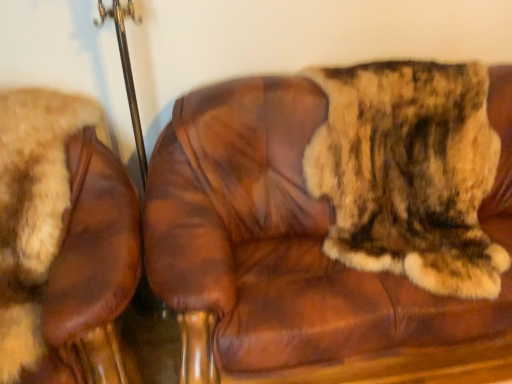
Locate an element on the screen. The width and height of the screenshot is (512, 384). brown leather chair at left, positioned as the second chair in right-to-left order is located at coordinates (32, 210).

Locate an element on the screen. The image size is (512, 384). fuzzy brown fur at right is located at coordinates (409, 172).

Which is behind, brown leather chair at center, which is the first chair in right-to-left order, or brown leather chair at left, the 1th chair in the left-to-right sequence?

brown leather chair at center, which is the first chair in right-to-left order, is more distant.

From the image's perspective, which is below, brown leather chair at center, the 2th chair in the left-to-right sequence, or brown leather chair at left, the 1th chair in the left-to-right sequence?

brown leather chair at left, the 1th chair in the left-to-right sequence, is shown below in the image.

Does brown leather chair at center, which is the first chair in right-to-left order, appear on the right side of brown leather chair at left, the 1th chair in the left-to-right sequence?

Indeed, brown leather chair at center, which is the first chair in right-to-left order, is positioned on the right side of brown leather chair at left, the 1th chair in the left-to-right sequence.

The height and width of the screenshot is (384, 512). There is a brown leather chair at left, positioned as the second chair in right-to-left order. Identify the location of chair above it (from a real-world perspective). (273, 244).

Is point (221, 306) positioned in front of point (327, 171)?

Yes, it is.

Can you confirm if brown leather chair at center, the 2th chair in the left-to-right sequence, is wider than fuzzy brown fur at right?

Yes, brown leather chair at center, the 2th chair in the left-to-right sequence, is wider than fuzzy brown fur at right.

Is brown leather chair at center, which is the first chair in right-to-left order, placed right next to fuzzy brown fur at right?

No, brown leather chair at center, which is the first chair in right-to-left order, is not beside fuzzy brown fur at right.

Based on their positions, is brown leather chair at center, which is the first chair in right-to-left order, located to the left or right of fuzzy brown fur at right?

brown leather chair at center, which is the first chair in right-to-left order, is to the left of fuzzy brown fur at right.

What's the angular difference between brown leather chair at left, the 1th chair in the left-to-right sequence, and fuzzy brown fur at right's facing directions?

brown leather chair at left, the 1th chair in the left-to-right sequence, and fuzzy brown fur at right are facing 0.000237 degrees away from each other.

Is point (24, 272) less distant than point (434, 204)?

Yes, it is in front of point (434, 204).

From the picture: Could you tell me if brown leather chair at left, the 1th chair in the left-to-right sequence, is facing fuzzy brown fur at right?

No, brown leather chair at left, the 1th chair in the left-to-right sequence, is not aimed at fuzzy brown fur at right.

How different are the orientations of fuzzy brown fur at right and brown leather chair at center, which is the first chair in right-to-left order, in degrees?

The angle between the facing direction of fuzzy brown fur at right and the facing direction of brown leather chair at center, which is the first chair in right-to-left order, is 0.000163 degrees.

Is fuzzy brown fur at right wider than brown leather chair at center, the 2th chair in the left-to-right sequence?

No.

Is fuzzy brown fur at right inside the boundaries of brown leather chair at center, the 2th chair in the left-to-right sequence, or outside?

fuzzy brown fur at right is located inside brown leather chair at center, the 2th chair in the left-to-right sequence.

From the image's perspective, is fuzzy brown fur at right positioned above or below brown leather chair at center, which is the first chair in right-to-left order?

From the image's perspective, fuzzy brown fur at right appears above brown leather chair at center, which is the first chair in right-to-left order.

Is brown leather chair at left, the 1th chair in the left-to-right sequence, located within fuzzy brown fur at right?

No, brown leather chair at left, the 1th chair in the left-to-right sequence, is located outside of fuzzy brown fur at right.

Is fuzzy brown fur at right positioned with its back to brown leather chair at left, positioned as the second chair in right-to-left order?

No, fuzzy brown fur at right's orientation is not away from brown leather chair at left, positioned as the second chair in right-to-left order.

Consider the image. From a real-world perspective, does fuzzy brown fur at right stand above brown leather chair at left, positioned as the second chair in right-to-left order?

Indeed, from a real-world perspective, fuzzy brown fur at right stands above brown leather chair at left, positioned as the second chair in right-to-left order.

At what (x,y) coordinates should I click in order to perform the action: click on cat on the right of brown leather chair at left, the 1th chair in the left-to-right sequence. Please return your answer as a coordinate pair (x, y). Looking at the image, I should click on (409, 172).

Is brown leather chair at left, the 1th chair in the left-to-right sequence, taller than brown leather chair at center, which is the first chair in right-to-left order?

In fact, brown leather chair at left, the 1th chair in the left-to-right sequence, may be shorter than brown leather chair at center, which is the first chair in right-to-left order.

From the image's perspective, is brown leather chair at left, positioned as the second chair in right-to-left order, above or below brown leather chair at center, which is the first chair in right-to-left order?

brown leather chair at left, positioned as the second chair in right-to-left order, is below brown leather chair at center, which is the first chair in right-to-left order.

In the image, is brown leather chair at left, positioned as the second chair in right-to-left order, positioned in front of or behind brown leather chair at center, which is the first chair in right-to-left order?

In the image, brown leather chair at left, positioned as the second chair in right-to-left order, appears in front of brown leather chair at center, which is the first chair in right-to-left order.

Between brown leather chair at left, positioned as the second chair in right-to-left order, and brown leather chair at center, the 2th chair in the left-to-right sequence, which one has smaller width?

With smaller width is brown leather chair at center, the 2th chair in the left-to-right sequence.

Identify the location of chair above the brown leather chair at left, the 1th chair in the left-to-right sequence (from the image's perspective). The height and width of the screenshot is (384, 512). (273, 244).

Where is `the 1st chair located beneath the fuzzy brown fur at right (from a real-world perspective)`? Image resolution: width=512 pixels, height=384 pixels. the 1st chair located beneath the fuzzy brown fur at right (from a real-world perspective) is located at coordinates (273, 244).

Considering their positions, is brown leather chair at left, the 1th chair in the left-to-right sequence, positioned further to brown leather chair at center, which is the first chair in right-to-left order, than fuzzy brown fur at right?

The object further to brown leather chair at center, which is the first chair in right-to-left order, is brown leather chair at left, the 1th chair in the left-to-right sequence.

Based on their spatial positions, is fuzzy brown fur at right or brown leather chair at left, positioned as the second chair in right-to-left order, further from brown leather chair at center, which is the first chair in right-to-left order?

brown leather chair at left, positioned as the second chair in right-to-left order.

Estimate the real-world distances between objects in this image. Which object is further from brown leather chair at left, the 1th chair in the left-to-right sequence, fuzzy brown fur at right or brown leather chair at center, the 2th chair in the left-to-right sequence?

fuzzy brown fur at right is further to brown leather chair at left, the 1th chair in the left-to-right sequence.

When comparing their distances from fuzzy brown fur at right, does brown leather chair at center, the 2th chair in the left-to-right sequence, or brown leather chair at left, the 1th chair in the left-to-right sequence, seem further?

brown leather chair at left, the 1th chair in the left-to-right sequence, lies further to fuzzy brown fur at right than the other object.

Looking at the image, which one is located further to brown leather chair at left, the 1th chair in the left-to-right sequence, brown leather chair at center, the 2th chair in the left-to-right sequence, or fuzzy brown fur at right?

fuzzy brown fur at right.

Looking at the image, which one is located further to fuzzy brown fur at right, brown leather chair at left, the 1th chair in the left-to-right sequence, or brown leather chair at center, the 2th chair in the left-to-right sequence?

brown leather chair at left, the 1th chair in the left-to-right sequence, is further to fuzzy brown fur at right.

This screenshot has height=384, width=512. In order to click on chair between brown leather chair at left, the 1th chair in the left-to-right sequence, and fuzzy brown fur at right, in the horizontal direction in this screenshot , I will do `click(273, 244)`.